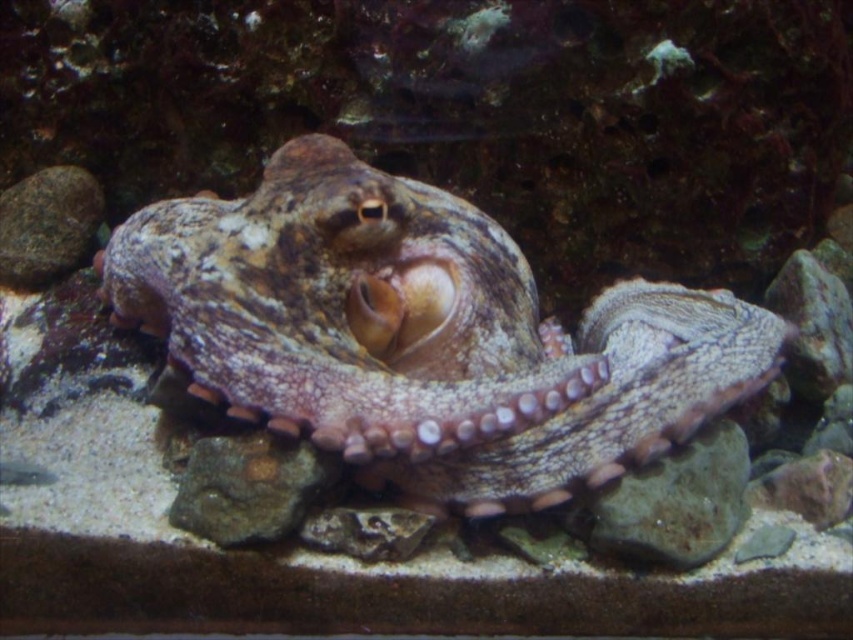
From the picture: You are an underwater explorer with a 20 inch long tool. You need to place your tool between the green mossy rock at center and the gray rock at upper left. Can your tool fit in the space between them?

The distance between the green mossy rock at center and the gray rock at upper left is 22.69 inches. Since your tool is 20 inches long, it can fit in the space between them as it is shorter than the available distance.